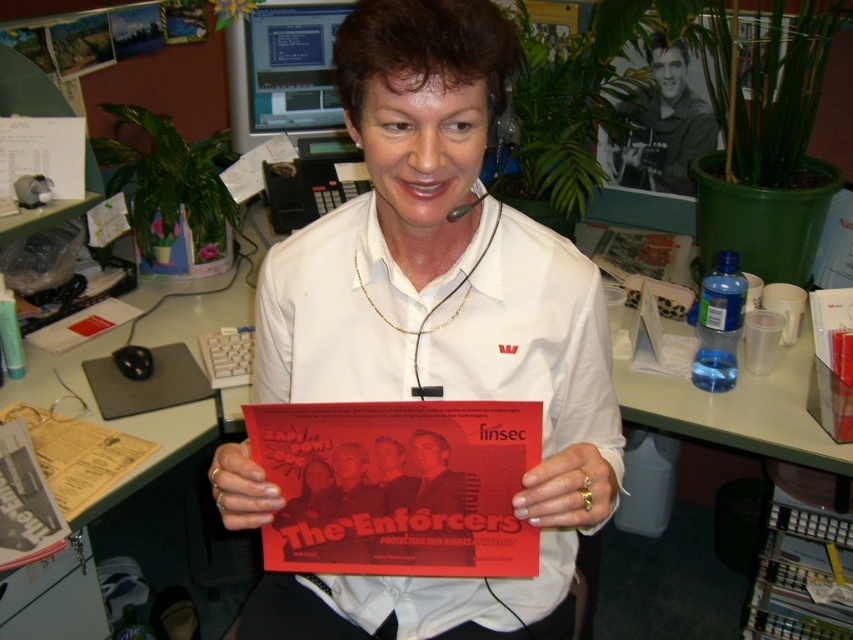
Which of these two, red paper brochure at center or gold ring at center, stands shorter?

gold ring at center

Between red paper brochure at center and gold ring at center, which one appears on the right side from the viewer's perspective?

red paper brochure at center

Is point (796, 589) closer to viewer compared to point (614, 477)?

No, it is not.

This screenshot has height=640, width=853. In order to click on red paper brochure at center in this screenshot , I will do `click(799, 577)`.

Is the position of matte paper booklet at center less distant than that of matte paper brochure at center?

No.

Does matte paper booklet at center appear on the right side of matte paper brochure at center?

Incorrect, matte paper booklet at center is not on the right side of matte paper brochure at center.

What do you see at coordinates (24, 502) in the screenshot? I see `matte paper booklet at center` at bounding box center [24, 502].

At what (x,y) coordinates should I click in order to perform the action: click on matte paper booklet at center. Please return your answer as a coordinate pair (x, y). Looking at the image, I should click on (24, 502).

Does red paper brochure at center appear under matte paper booklet at center?

Yes.

Does red paper brochure at center appear over matte paper booklet at center?

Incorrect, red paper brochure at center is not positioned above matte paper booklet at center.

Is point (839, 611) closer to viewer compared to point (7, 432)?

That is False.

You are a GUI agent. You are given a task and a screenshot of the screen. Output one action in this format:
    pyautogui.click(x=<x>, y=<y>)
    Task: Click on the red paper brochure at center
    The width and height of the screenshot is (853, 640).
    Given the screenshot: What is the action you would take?
    click(799, 577)